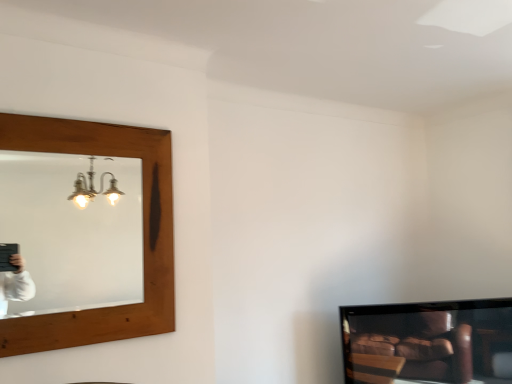
Image resolution: width=512 pixels, height=384 pixels. I want to click on matte black television at lower right, so click(x=428, y=342).

Image resolution: width=512 pixels, height=384 pixels. What do you see at coordinates (428, 342) in the screenshot?
I see `matte black television at lower right` at bounding box center [428, 342].

Measure the distance between matte black television at lower right and camera.

matte black television at lower right and camera are 7.64 feet apart.

The height and width of the screenshot is (384, 512). What do you see at coordinates (70, 233) in the screenshot? I see `wooden mirror at upper left` at bounding box center [70, 233].

At what (x,y) coordinates should I click in order to perform the action: click on wooden mirror at upper left. Please return your answer as a coordinate pair (x, y). Looking at the image, I should click on (70, 233).

The image size is (512, 384). What are the coordinates of `matte black television at lower right` in the screenshot? It's located at (428, 342).

Does wooden mirror at upper left appear on the right side of matte black television at lower right?

Incorrect, wooden mirror at upper left is not on the right side of matte black television at lower right.

Is wooden mirror at upper left positioned in front of matte black television at lower right?

Yes, it is.

Is point (60, 191) closer to camera compared to point (383, 329)?

No, it is not.

From the image's perspective, between wooden mirror at upper left and matte black television at lower right, who is located below?

matte black television at lower right.

From a real-world perspective, relative to matte black television at lower right, is wooden mirror at upper left vertically above or below?

In terms of real-world spatial position, wooden mirror at upper left is above matte black television at lower right.

Is wooden mirror at upper left thinner than matte black television at lower right?

Indeed, wooden mirror at upper left has a lesser width compared to matte black television at lower right.

Which of these two, wooden mirror at upper left or matte black television at lower right, stands taller?

wooden mirror at upper left is taller.

Does wooden mirror at upper left have a larger size compared to matte black television at lower right?

Incorrect, wooden mirror at upper left is not larger than matte black television at lower right.

Is wooden mirror at upper left inside the boundaries of matte black television at lower right, or outside?

wooden mirror at upper left cannot be found inside matte black television at lower right.

Are wooden mirror at upper left and matte black television at lower right far apart?

That's right, there is a large distance between wooden mirror at upper left and matte black television at lower right.

Is wooden mirror at upper left oriented away from matte black television at lower right?

No, matte black television at lower right is not at the back of wooden mirror at upper left.

Find the location of a particular element. The image size is (512, 384). mirror on the left of matte black television at lower right is located at coordinates (70, 233).

Which object is positioned more to the right, matte black television at lower right or wooden mirror at upper left?

matte black television at lower right is more to the right.

Considering the positions of objects matte black television at lower right and wooden mirror at upper left in the image provided, who is in front, matte black television at lower right or wooden mirror at upper left?

wooden mirror at upper left.

Considering the positions of point (407, 323) and point (3, 155), is point (407, 323) closer or farther from the camera than point (3, 155)?

Point (407, 323) is closer to the camera than point (3, 155).

Looking at this image, from the image's perspective, is matte black television at lower right on wooden mirror at upper left?

No, from the image's perspective, matte black television at lower right is not above wooden mirror at upper left.

Based on the photo, from a real-world perspective, is matte black television at lower right physically above wooden mirror at upper left?

No, from a real-world perspective, matte black television at lower right is not on top of wooden mirror at upper left.

Considering the sizes of objects matte black television at lower right and wooden mirror at upper left in the image provided, who is thinner, matte black television at lower right or wooden mirror at upper left?

wooden mirror at upper left.

Who is taller, matte black television at lower right or wooden mirror at upper left?

wooden mirror at upper left.

Which of these two, matte black television at lower right or wooden mirror at upper left, is smaller?

wooden mirror at upper left.

Would you say matte black television at lower right is outside wooden mirror at upper left?

matte black television at lower right is positioned outside wooden mirror at upper left.

Is matte black television at lower right far away from wooden mirror at upper left?

matte black television at lower right is far away from wooden mirror at upper left.

In the scene shown: Is matte black television at lower right facing away from wooden mirror at upper left?

No, matte black television at lower right is not facing the opposite direction of wooden mirror at upper left.

What's the angular difference between matte black television at lower right and wooden mirror at upper left's facing directions?

29.6 degrees.

This screenshot has width=512, height=384. What are the coordinates of `mirror on the left side of matte black television at lower right` in the screenshot? It's located at (70, 233).

At what (x,y) coordinates should I click in order to perform the action: click on mirror on the left of matte black television at lower right. Please return your answer as a coordinate pair (x, y). The height and width of the screenshot is (384, 512). Looking at the image, I should click on (70, 233).

Image resolution: width=512 pixels, height=384 pixels. I want to click on television located on the right of wooden mirror at upper left, so click(428, 342).